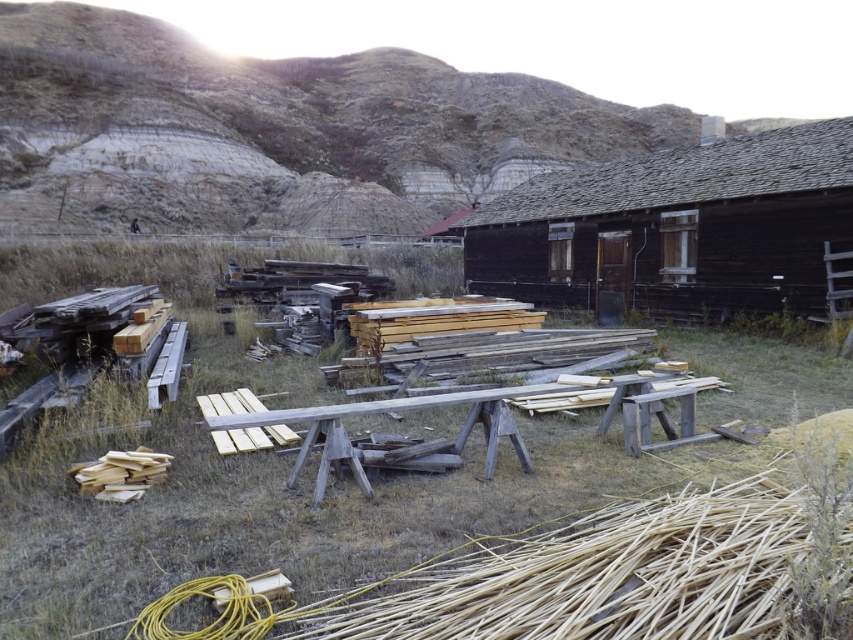
You are planning to set up a picnic in the area shown. Considering the green grass at center and the wooden picnic table at center, which surface would be more suitable for placing your picnic basket?

The wooden picnic table at center is more suitable for placing the picnic basket because the green grass at center has a greater height, which might make the grass uneven or difficult to sit on.

You are standing in front of the dark brown wooden cabin at center and want to place a new wooden picnic table at center in the scene. Based on the current layout, where should you position the picnic table at center relative to the cabin?

The wooden picnic table at center should be placed behind the dark brown wooden cabin at center as it is currently positioned there.

You are planning to install a new light fixture. The dark brown wooden cabin at center and the wooden picnic table at center are both candidates for mounting. Which structure is taller and thus more suitable for the light fixture?

The dark brown wooden cabin at center is taller than the wooden picnic table at center, making it more suitable for mounting the light fixture.